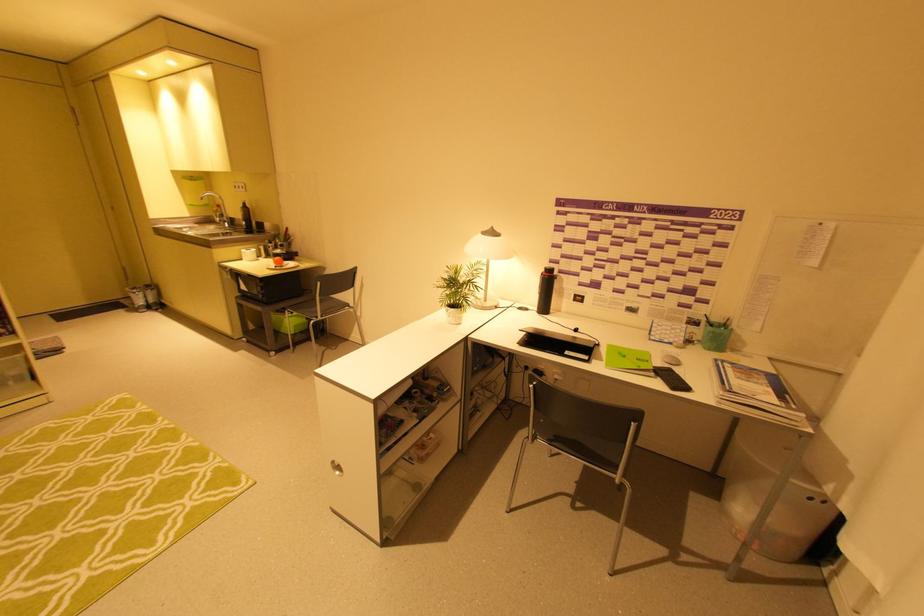
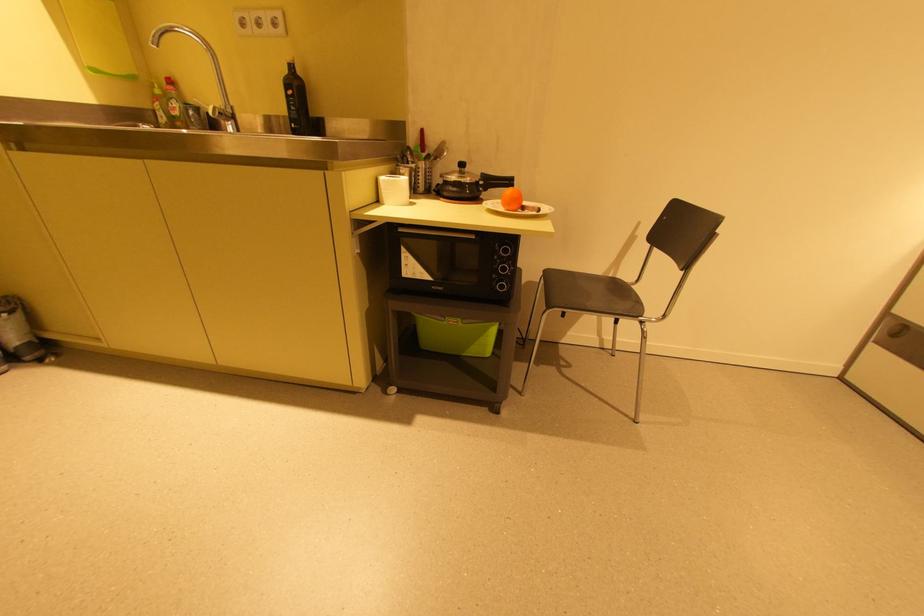
Where in the second image is the point corresponding to [246,206] from the first image?

(289, 71)